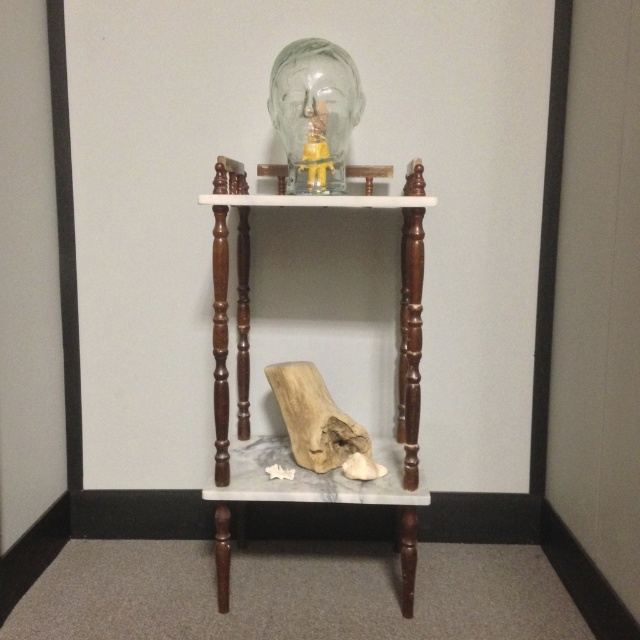
Which is more to the right, wooden side table at center or white marble stool at lower center?

Positioned to the right is white marble stool at lower center.

Locate an element on the screen. The width and height of the screenshot is (640, 640). wooden side table at center is located at coordinates (248, 368).

Locate an element on the screen. wooden side table at center is located at coordinates (248, 368).